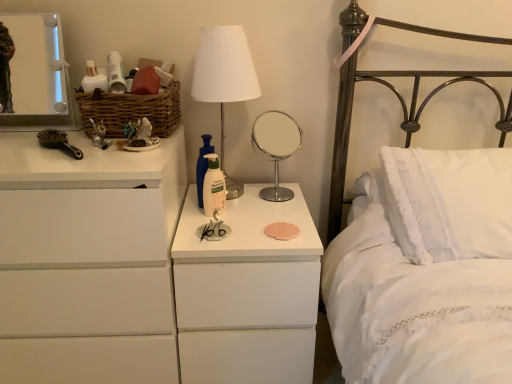
Identify the location of vacant space to the right of white matte lotion at center. (272, 206).